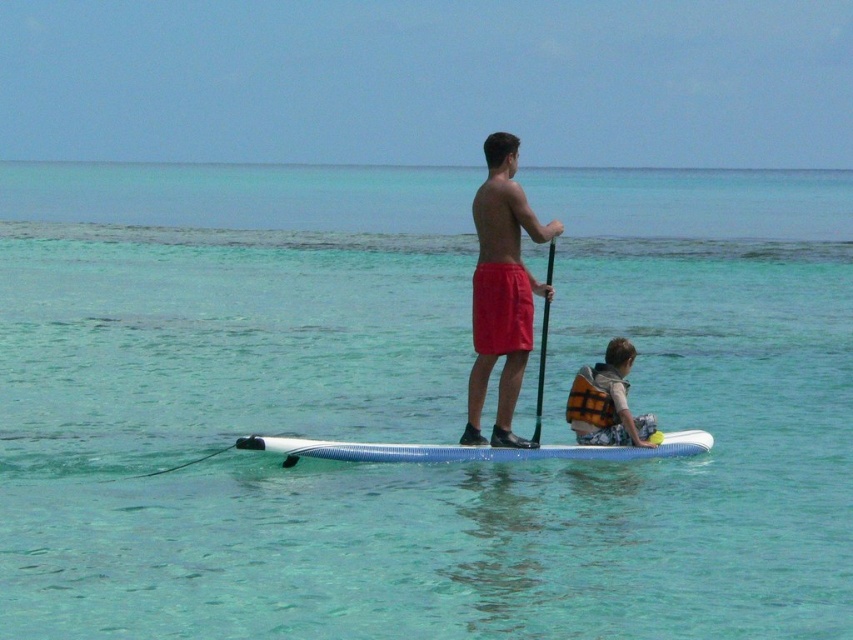
Between point (538, 449) and point (639, 422), which one is positioned behind?

The point (639, 422) is behind.

Can you confirm if white glossy surfboard at center is shorter than orange life vest at center?

Indeed, white glossy surfboard at center has a lesser height compared to orange life vest at center.

Locate an element on the screen. This screenshot has width=853, height=640. white glossy surfboard at center is located at coordinates (469, 449).

What do you see at coordinates (607, 401) in the screenshot? The width and height of the screenshot is (853, 640). I see `orange life vest at center` at bounding box center [607, 401].

Does orange life vest at center have a smaller size compared to black rubber paddle at center?

Actually, orange life vest at center might be larger than black rubber paddle at center.

This screenshot has height=640, width=853. I want to click on orange life vest at center, so click(x=607, y=401).

Find the location of `matte red shorts at center`. matte red shorts at center is located at coordinates (502, 289).

Can you confirm if matte red shorts at center is smaller than orange life vest at center?

No, matte red shorts at center is not smaller than orange life vest at center.

This screenshot has width=853, height=640. Describe the element at coordinates (502, 289) in the screenshot. I see `matte red shorts at center` at that location.

Locate an element on the screen. This screenshot has width=853, height=640. matte red shorts at center is located at coordinates (502, 289).